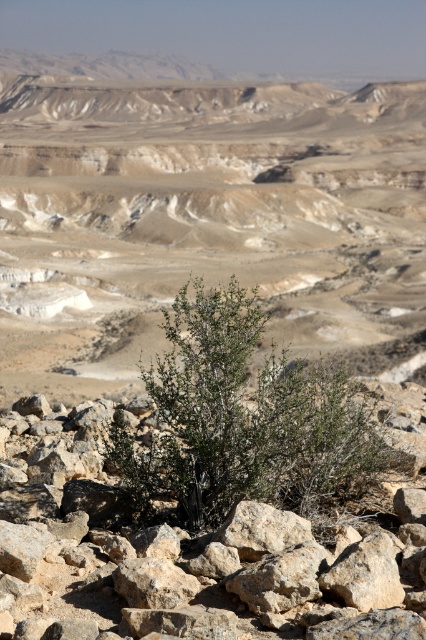
Who is taller, rough textured rock at center or green leafy shrub at center?

With more height is green leafy shrub at center.

Is rough textured rock at center in front of green leafy shrub at center?

Yes, it is.

Identify the location of rough textured rock at center. Image resolution: width=426 pixels, height=640 pixels. (198, 561).

Identify the location of rough textured rock at center. This screenshot has width=426, height=640. (198, 561).